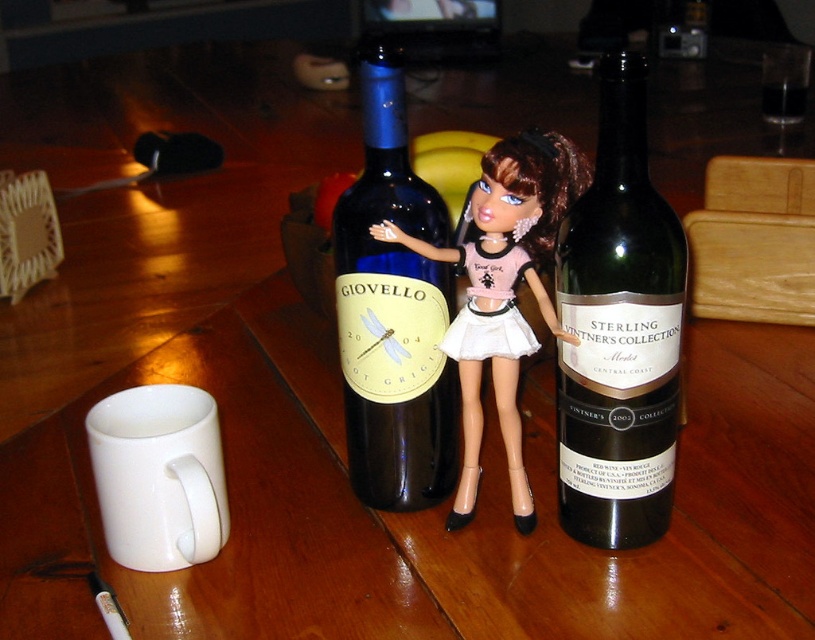
You are a guest in this living room and want to pick up the dark green glass bottle at center and the blue glass bottle at center. Which one should you reach for first to get the closer one?

The dark green glass bottle at center is closer to the viewer than the blue glass bottle at center, so you should reach for the dark green glass bottle at center first.

What is the spatial relationship between the blue glass bottle at center and the matte black doll at center?

The blue glass bottle at center is closer to the viewer than the matte black doll at center.

You are organizing a party and need to arrange the dark green glass bottle at center and the matte black doll at center on a shelf. Which object should you place first to ensure both fit properly?

The dark green glass bottle at center is smaller than the matte black doll at center, so you should place the matte black doll at center first to make space for the smaller bottle.